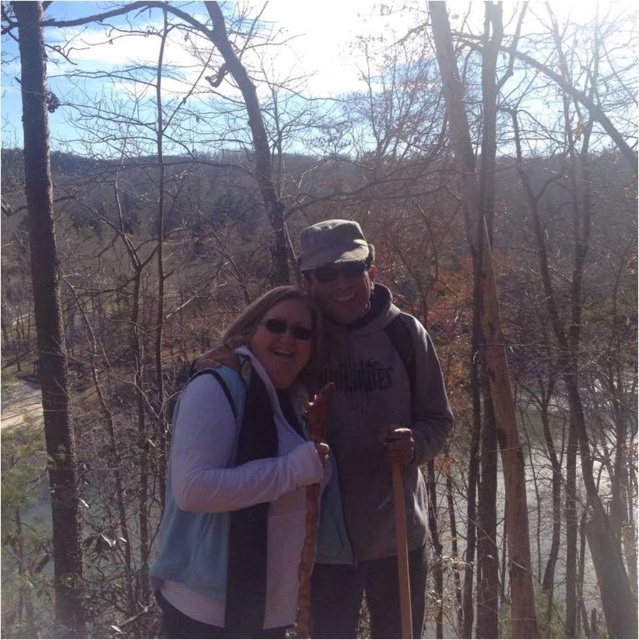
You are a photographer trying to capture a clear shot of both the blue fabric vest at center and the gray matte jacket at center. Since you want both subjects to be in focus, which one should you adjust your camera focus on first?

You should focus on the blue fabric vest at center first because it is closer to the viewer than the gray matte jacket at center, ensuring both are in focus by starting with the nearest subject.

You are a photographer planning to take a portrait of the two people in the scene. You notice the blue fabric vest at center is at point (240, 477). If you want to ensure the vest is centered in your photo, where should you position your camera relative to the two people?

To center the blue fabric vest at center in the photo, position the camera so that the vest is at the center point (240, 477) relative to the two people.